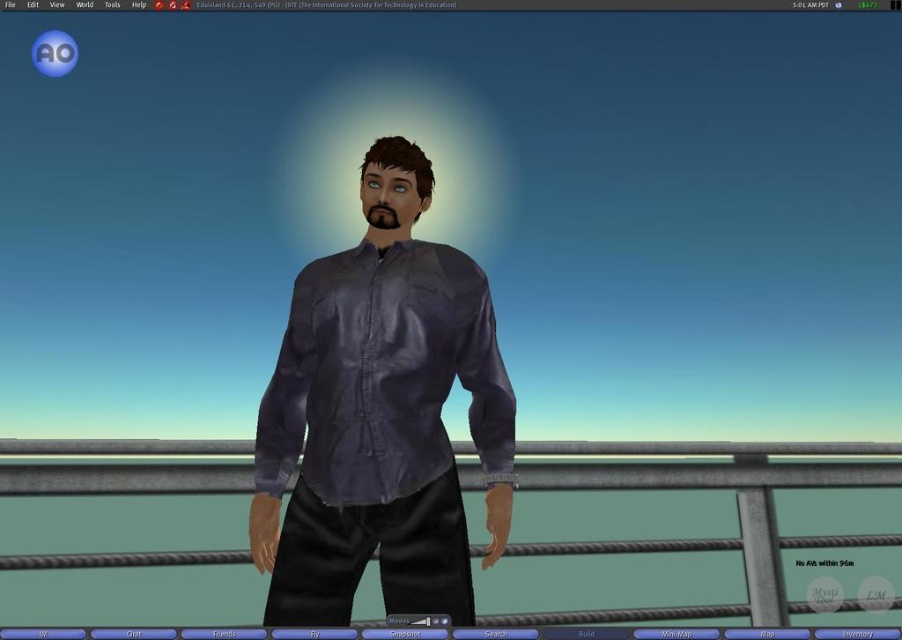
You are a virtual assistant in a game. You need to determine if you can interact with the matte purple shirt at center from your current position. The interaction requires being within 5 feet. Can you do it?

The matte purple shirt at center and viewer are 6.36 feet apart, which is beyond the 5 feet interaction range. You cannot interact with it from your current position.

Based on the photo, you are a character in the game and need to interact with both the matte purple shirt at center and the ropemetallicrail at center. Which object should you target first if you want to interact with the one closer to your current position?

The matte purple shirt at center is located above the ropemetallicrail at center, so it is closer to you and should be targeted first.

You are navigating a virtual environment and need to determine the proximity of two points relative to your position. Given the points labeled as point (453, 300) and point (228, 550), which one is nearer to you?

Point (453, 300) is closer to the viewer than point (228, 550).